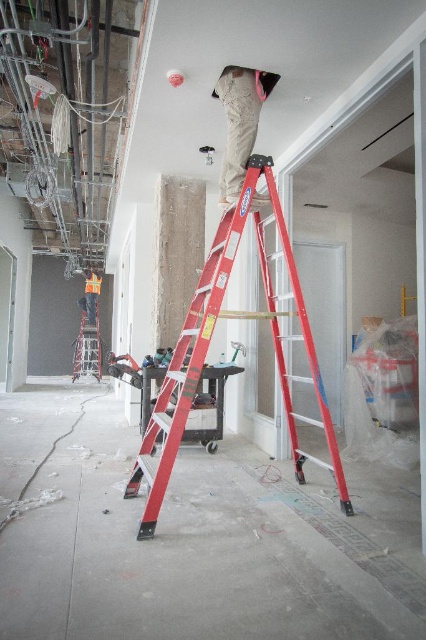
Question: Observing the image, what is the correct spatial positioning of metallic silver ladder at center in reference to reflective orange vest at center?

Choices:
 (A) right
 (B) left

Answer: (A)

Question: Estimate the real-world distances between objects in this image. Which object is farther from the metallic silver ladder at center?

Choices:
 (A) khaki cotton pants at center
 (B) red metallic ladder at center
 (C) reflective orange vest at center

Answer: (A)

Question: Considering the relative positions of red metallic ladder at center and khaki cotton pants at center in the image provided, where is red metallic ladder at center located with respect to khaki cotton pants at center?

Choices:
 (A) above
 (B) below

Answer: (B)

Question: Which object is farther from the camera taking this photo?

Choices:
 (A) khaki cotton pants at center
 (B) metallic silver ladder at center

Answer: (B)

Question: In this image, where is khaki cotton pants at center located relative to metallic silver ladder at center?

Choices:
 (A) right
 (B) left

Answer: (A)

Question: Which of the following is the closest to the observer?

Choices:
 (A) (149, 531)
 (B) (270, 76)
 (C) (98, 291)

Answer: (A)